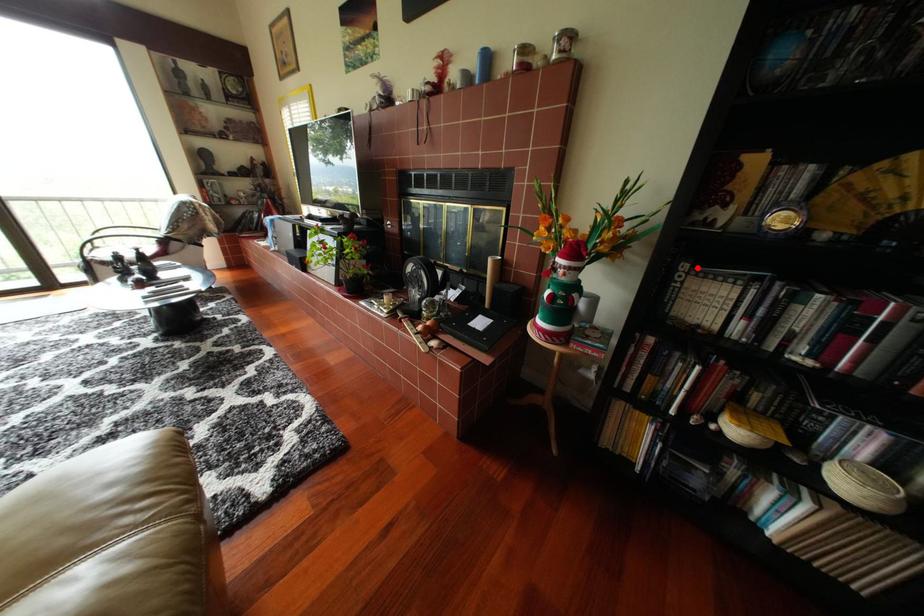
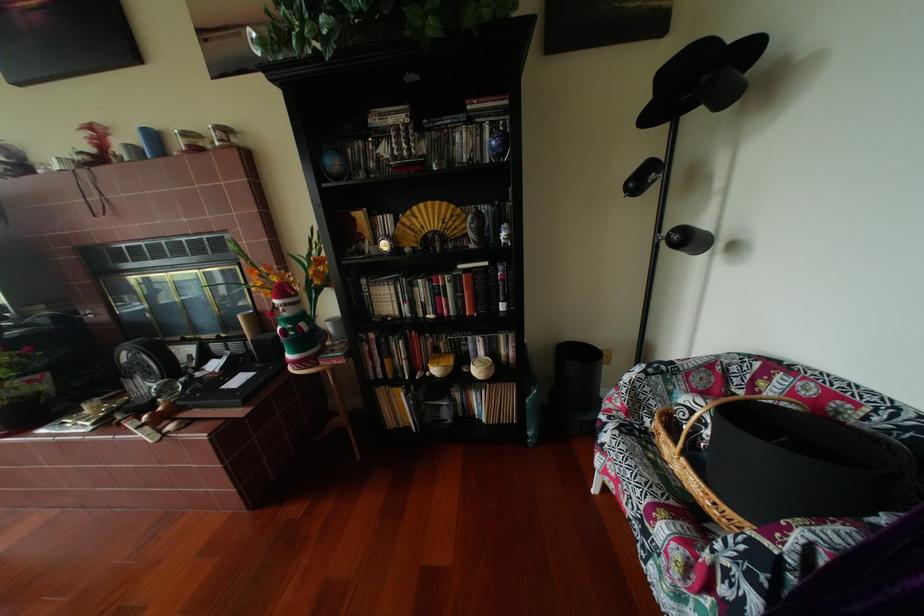
Locate, in the second image, the point that corresponds to the highlighted location in the first image.

(377, 283)